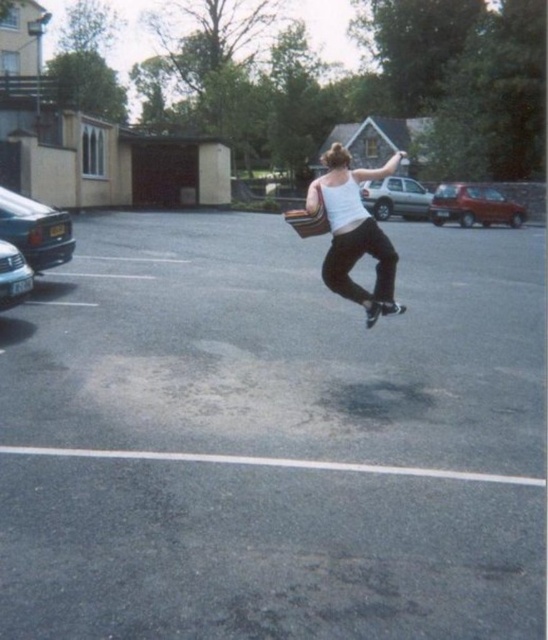
Question: In this image, where is asphalt at center located relative to shiny blue sedan at left?

Choices:
 (A) above
 (B) below

Answer: (B)

Question: Does shiny blue sedan at left have a greater width compared to silver metallic hatchback at center?

Choices:
 (A) yes
 (B) no

Answer: (B)

Question: Which object is closer to the camera taking this photo?

Choices:
 (A) shiny blue sedan at left
 (B) white matte tank top at center

Answer: (B)

Question: Is shiny blue sedan at left wider than silver metallic hatchback at center?

Choices:
 (A) yes
 (B) no

Answer: (B)

Question: Among these points, which one is nearest to the camera?

Choices:
 (A) (8, 300)
 (B) (376, 268)
 (C) (48, 225)
 (D) (533, 360)

Answer: (B)

Question: Which point is farther to the camera?

Choices:
 (A) (309, 202)
 (B) (14, 248)

Answer: (B)